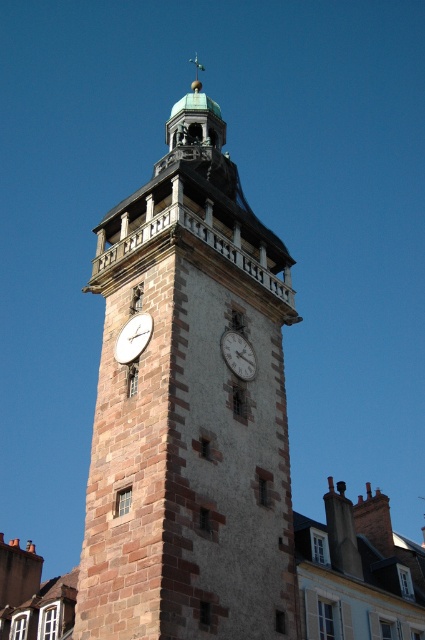
Is brown stone clock tower at center to the right of matte stone clock at center from the viewer's perspective?

No, brown stone clock tower at center is not to the right of matte stone clock at center.

Based on the photo, measure the distance between brown stone clock tower at center and camera.

brown stone clock tower at center is 27.28 meters from camera.

Identify the location of brown stone clock tower at center. The width and height of the screenshot is (425, 640). (189, 410).

Is brown stone clock tower at center thinner than matte brown clock at center?

Incorrect, brown stone clock tower at center's width is not less than matte brown clock at center's.

Can you confirm if brown stone clock tower at center is positioned below matte brown clock at center?

No, brown stone clock tower at center is not below matte brown clock at center.

What are the coordinates of `brown stone clock tower at center` in the screenshot? It's located at (189, 410).

Locate an element on the screen. The width and height of the screenshot is (425, 640). brown stone clock tower at center is located at coordinates coord(189,410).

Which is in front, point (122, 360) or point (238, 346)?

Point (122, 360)

Is matte brown clock at center wider than matte stone clock at center?

Yes, matte brown clock at center is wider than matte stone clock at center.

Locate an element on the screen. The image size is (425, 640). matte brown clock at center is located at coordinates (133, 337).